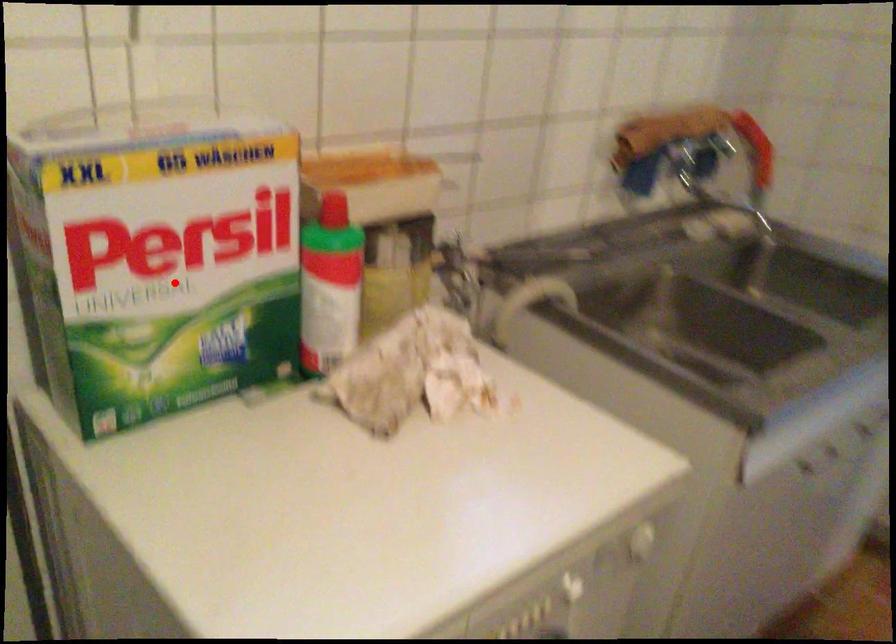
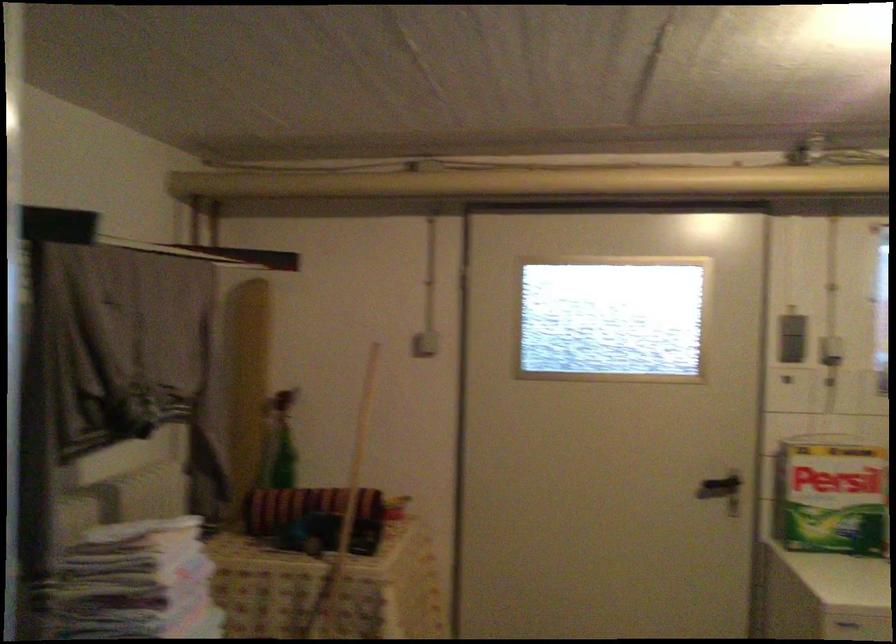
Locate, in the second image, the point that corresponds to the highlighted location in the first image.

(831, 496)